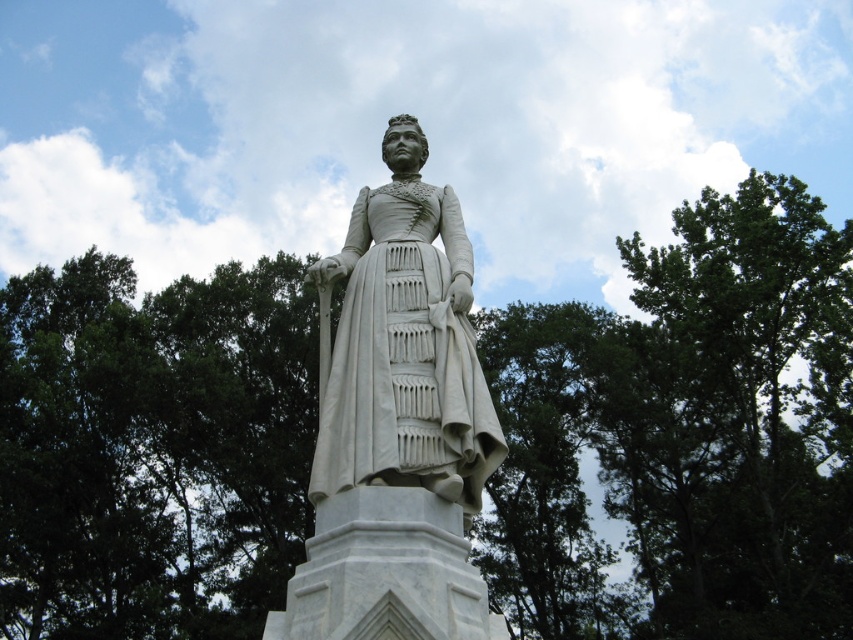
Does green leafy tree at center have a larger size compared to white marble statue at center?

Yes, green leafy tree at center is bigger than white marble statue at center.

Is point (724, 305) positioned after point (469, 451)?

Yes.

I want to click on green leafy tree at center, so click(x=683, y=433).